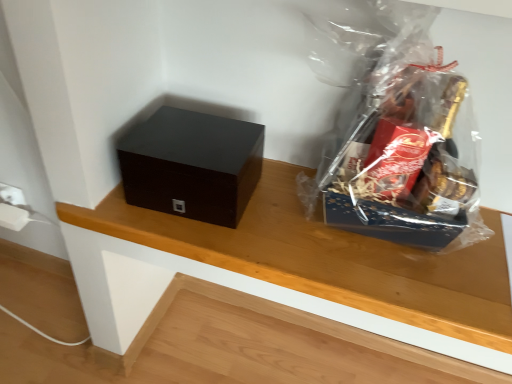
Question: Does transparent plastic gift basket at upper right have a greater width compared to matte black box at left?

Choices:
 (A) yes
 (B) no

Answer: (A)

Question: Does transparent plastic gift basket at upper right come behind matte black box at left?

Choices:
 (A) yes
 (B) no

Answer: (B)

Question: Are transparent plastic gift basket at upper right and matte black box at left located far from each other?

Choices:
 (A) yes
 (B) no

Answer: (B)

Question: From the image's perspective, does transparent plastic gift basket at upper right appear higher than matte black box at left?

Choices:
 (A) yes
 (B) no

Answer: (A)

Question: Does transparent plastic gift basket at upper right appear on the left side of matte black box at left?

Choices:
 (A) yes
 (B) no

Answer: (B)

Question: Considering the positions of matte black box at left and transparent plastic gift basket at upper right in the image, is matte black box at left wider or thinner than transparent plastic gift basket at upper right?

Choices:
 (A) wide
 (B) thin

Answer: (B)

Question: In terms of size, does matte black box at left appear bigger or smaller than transparent plastic gift basket at upper right?

Choices:
 (A) big
 (B) small

Answer: (B)

Question: Do you think matte black box at left is within transparent plastic gift basket at upper right, or outside of it?

Choices:
 (A) outside
 (B) inside

Answer: (A)

Question: Relative to transparent plastic gift basket at upper right, is matte black box at left in front or behind?

Choices:
 (A) behind
 (B) front

Answer: (A)

Question: Visually, is wooden table at center positioned to the left or to the right of matte black box at left?

Choices:
 (A) right
 (B) left

Answer: (B)

Question: Considering the positions of wooden table at center and matte black box at left in the image, is wooden table at center taller or shorter than matte black box at left?

Choices:
 (A) tall
 (B) short

Answer: (B)

Question: In terms of width, does wooden table at center look wider or thinner when compared to matte black box at left?

Choices:
 (A) thin
 (B) wide

Answer: (A)

Question: From a real-world perspective, is wooden table at center above or below matte black box at left?

Choices:
 (A) above
 (B) below

Answer: (B)

Question: Is wooden table at center in front of or behind transparent plastic gift basket at upper right in the image?

Choices:
 (A) behind
 (B) front

Answer: (A)

Question: From the image's perspective, is wooden table at center above or below transparent plastic gift basket at upper right?

Choices:
 (A) below
 (B) above

Answer: (A)